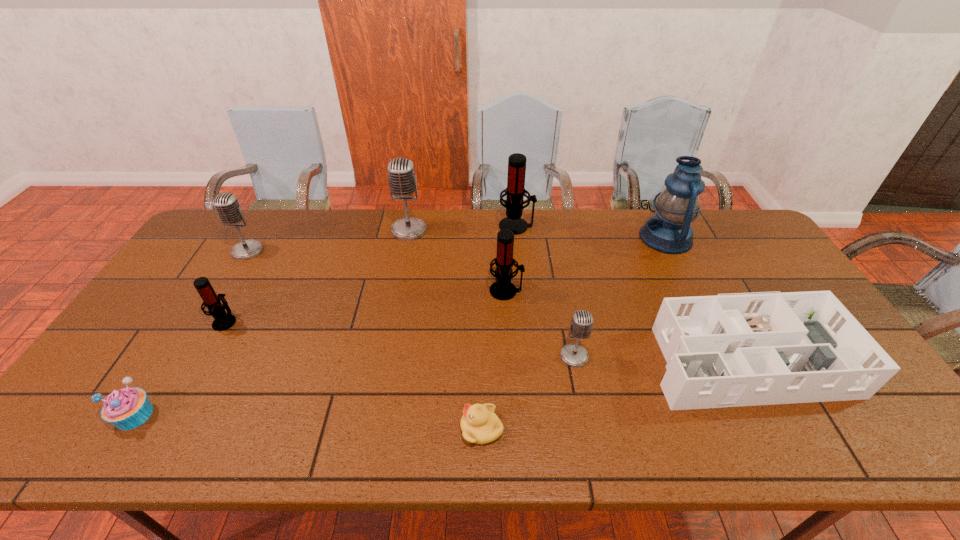
Locate an element on the screen. The width and height of the screenshot is (960, 540). blank area located 0.130m on the front-facing side of the yellow duckling is located at coordinates (403, 428).

Where is `lantern positioned at the far edge`? lantern positioned at the far edge is located at coordinates (669, 231).

Identify the location of muffin that is at the near edge. (127, 408).

At what (x,y) coordinates should I click in order to perform the action: click on duckling located at the near edge. Please return your answer as a coordinate pair (x, y). The width and height of the screenshot is (960, 540). Looking at the image, I should click on (479, 424).

I want to click on microphone at the left edge, so click(x=227, y=206).

Locate an element on the screen. This screenshot has height=540, width=960. muffin present at the left edge is located at coordinates (x=127, y=408).

The width and height of the screenshot is (960, 540). I want to click on object that is at the right edge, so click(x=750, y=349).

Identify the location of object that is at the far left corner. This screenshot has height=540, width=960. (227, 206).

Locate an element on the screen. This screenshot has height=540, width=960. object located at the near left corner is located at coordinates (127, 408).

Locate an element on the screen. vacant region at the far edge of the desktop is located at coordinates (452, 244).